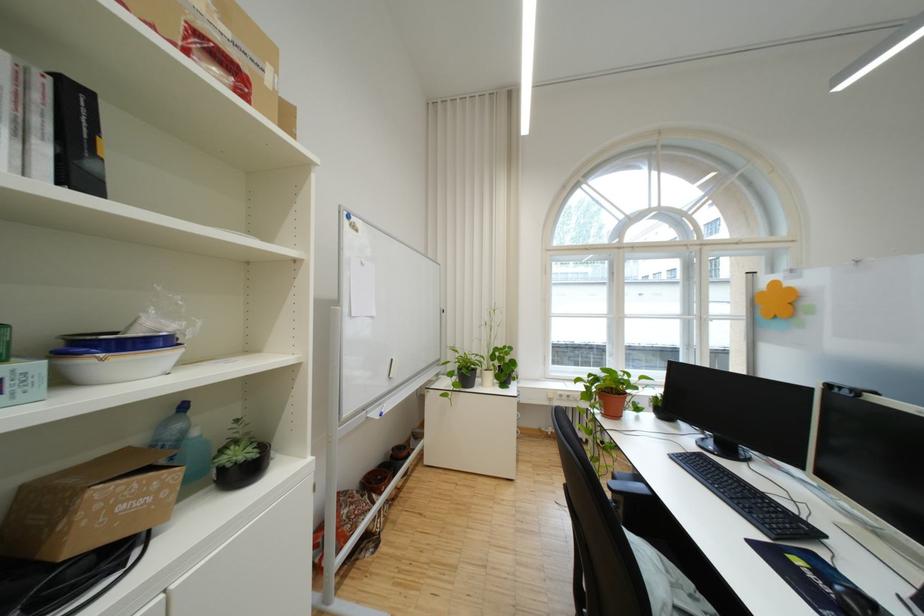
Describe the element at coordinates (693, 318) in the screenshot. The height and width of the screenshot is (616, 924). I see `the window handle` at that location.